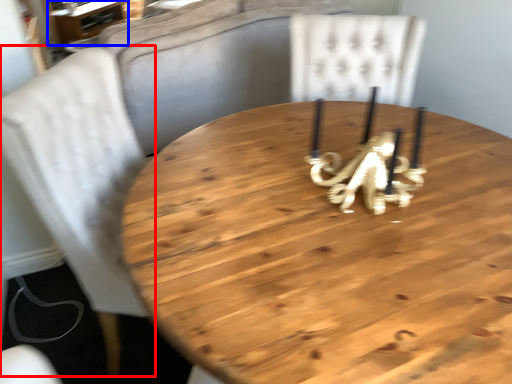
Question: Which of the following is the farthest to the observer, chair (highlighted by a red box) or table (highlighted by a blue box)?

Choices:
 (A) chair
 (B) table

Answer: (B)